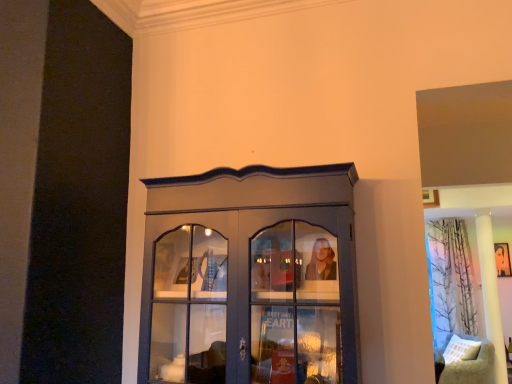
This screenshot has height=384, width=512. What do you see at coordinates (250, 277) in the screenshot?
I see `matte gray cupboard at center` at bounding box center [250, 277].

Describe the element at coordinates (450, 278) in the screenshot. The image size is (512, 384). I see `printed fabric curtain at right` at that location.

What do you see at coordinates (471, 366) in the screenshot? I see `beige fabric cushion at lower right` at bounding box center [471, 366].

Identify the location of smooth black portrait at upper right. (502, 259).

Considering the points (505, 254) and (164, 198), which point is behind, point (505, 254) or point (164, 198)?

Positioned behind is point (505, 254).

Are smooth black portrait at upper right and matte gray cupboard at center located far from each other?

smooth black portrait at upper right is positioned a significant distance from matte gray cupboard at center.

Between smooth black portrait at upper right and matte gray cupboard at center, which one has more height?

With more height is matte gray cupboard at center.

Identify the location of cupboard on the left of smooth black portrait at upper right. The width and height of the screenshot is (512, 384). (250, 277).

What's the angular difference between printed fabric curtain at right and smooth black portrait at upper right's facing directions?

They differ by 2.08 degrees in their facing directions.

Who is shorter, printed fabric curtain at right or smooth black portrait at upper right?

With less height is smooth black portrait at upper right.

Would you say smooth black portrait at upper right is part of printed fabric curtain at right's contents?

No, smooth black portrait at upper right is not surrounded by printed fabric curtain at right.

From the image's perspective, is printed fabric curtain at right located above or below smooth black portrait at upper right?

Clearly, from the image's perspective, printed fabric curtain at right is below smooth black portrait at upper right.

Between smooth black portrait at upper right and beige fabric cushion at lower right, which one appears on the right side from the viewer's perspective?

smooth black portrait at upper right is more to the right.

Between smooth black portrait at upper right and beige fabric cushion at lower right, which one has larger size?

Bigger between the two is beige fabric cushion at lower right.

Is smooth black portrait at upper right thinner than beige fabric cushion at lower right?

Indeed, smooth black portrait at upper right has a lesser width compared to beige fabric cushion at lower right.

From the image's perspective, who appears lower, smooth black portrait at upper right or beige fabric cushion at lower right?

beige fabric cushion at lower right.

In terms of size, does printed fabric curtain at right appear bigger or smaller than beige fabric cushion at lower right?

Considering their sizes, printed fabric curtain at right takes up more space than beige fabric cushion at lower right.

In the scene shown: Between printed fabric curtain at right and beige fabric cushion at lower right, which one has more height?

With more height is printed fabric curtain at right.

From a real-world perspective, which is physically above, printed fabric curtain at right or beige fabric cushion at lower right?

In real-world perspective, printed fabric curtain at right is above.

Which is nearer, (484, 360) or (500, 261)?

Point (484, 360) is closer to the camera than point (500, 261).

Considering the relative sizes of beige fabric cushion at lower right and smooth black portrait at upper right in the image provided, is beige fabric cushion at lower right smaller than smooth black portrait at upper right?

Incorrect, beige fabric cushion at lower right is not smaller in size than smooth black portrait at upper right.

Which object is wider, beige fabric cushion at lower right or smooth black portrait at upper right?

beige fabric cushion at lower right is wider.

Between beige fabric cushion at lower right and smooth black portrait at upper right, which one is positioned behind?

smooth black portrait at upper right is further away from the camera.

Can you confirm if smooth black portrait at upper right is smaller than printed fabric curtain at right?

Yes.

Looking at this image, measure the distance from smooth black portrait at upper right to printed fabric curtain at right.

smooth black portrait at upper right and printed fabric curtain at right are 24.90 inches apart from each other.

Locate an element on the screen. person above the printed fabric curtain at right (from a real-world perspective) is located at coordinates (502, 259).

Does smooth black portrait at upper right lie in front of printed fabric curtain at right?

No, the depth of smooth black portrait at upper right is greater than that of printed fabric curtain at right.

Locate an element on the screen. This screenshot has height=384, width=512. cupboard above the smooth black portrait at upper right (from the image's perspective) is located at coordinates pyautogui.click(x=250, y=277).

Which object is wider, matte gray cupboard at center or smooth black portrait at upper right?

matte gray cupboard at center.

Considering the positions of objects matte gray cupboard at center and smooth black portrait at upper right in the image provided, who is more to the left, matte gray cupboard at center or smooth black portrait at upper right?

From the viewer's perspective, matte gray cupboard at center appears more on the left side.

What are the coordinates of `cupboard that is above the smooth black portrait at upper right (from the image's perspective)` in the screenshot? It's located at (250, 277).

Locate an element on the screen. curtain on the left of smooth black portrait at upper right is located at coordinates (450, 278).

Estimate the real-world distances between objects in this image. Which object is further from beige fabric cushion at lower right, printed fabric curtain at right or matte gray cupboard at center?

matte gray cupboard at center.

Which object lies further to the anchor point matte gray cupboard at center, beige fabric cushion at lower right or printed fabric curtain at right?

printed fabric curtain at right lies further to matte gray cupboard at center than the other object.

Based on the photo, from the image, which object appears to be nearer to smooth black portrait at upper right, matte gray cupboard at center or printed fabric curtain at right?

Among the two, printed fabric curtain at right is located nearer to smooth black portrait at upper right.

Based on their spatial positions, is matte gray cupboard at center or printed fabric curtain at right further from beige fabric cushion at lower right?

The object further to beige fabric cushion at lower right is matte gray cupboard at center.

Estimate the real-world distances between objects in this image. Which object is further from matte gray cupboard at center, beige fabric cushion at lower right or smooth black portrait at upper right?

Based on the image, smooth black portrait at upper right appears to be further to matte gray cupboard at center.

From the image, which object appears to be farther from smooth black portrait at upper right, beige fabric cushion at lower right or matte gray cupboard at center?

matte gray cupboard at center is further to smooth black portrait at upper right.

When comparing their distances from matte gray cupboard at center, does printed fabric curtain at right or beige fabric cushion at lower right seem further?

Among the two, printed fabric curtain at right is located further to matte gray cupboard at center.

Which object lies further to the anchor point printed fabric curtain at right, beige fabric cushion at lower right or matte gray cupboard at center?

The object further to printed fabric curtain at right is matte gray cupboard at center.

Identify the location of curtain between matte gray cupboard at center and smooth black portrait at upper right in the front-back direction. This screenshot has height=384, width=512. (450, 278).

The height and width of the screenshot is (384, 512). Find the location of `furniture located between matte gray cupboard at center and printed fabric curtain at right in the depth direction`. furniture located between matte gray cupboard at center and printed fabric curtain at right in the depth direction is located at coordinates (471, 366).

Where is `furniture between matte gray cupboard at center and smooth black portrait at upper right in the front-back direction`? This screenshot has width=512, height=384. furniture between matte gray cupboard at center and smooth black portrait at upper right in the front-back direction is located at coordinates (471, 366).

Locate an element on the screen. Image resolution: width=512 pixels, height=384 pixels. curtain between beige fabric cushion at lower right and smooth black portrait at upper right from front to back is located at coordinates (450, 278).